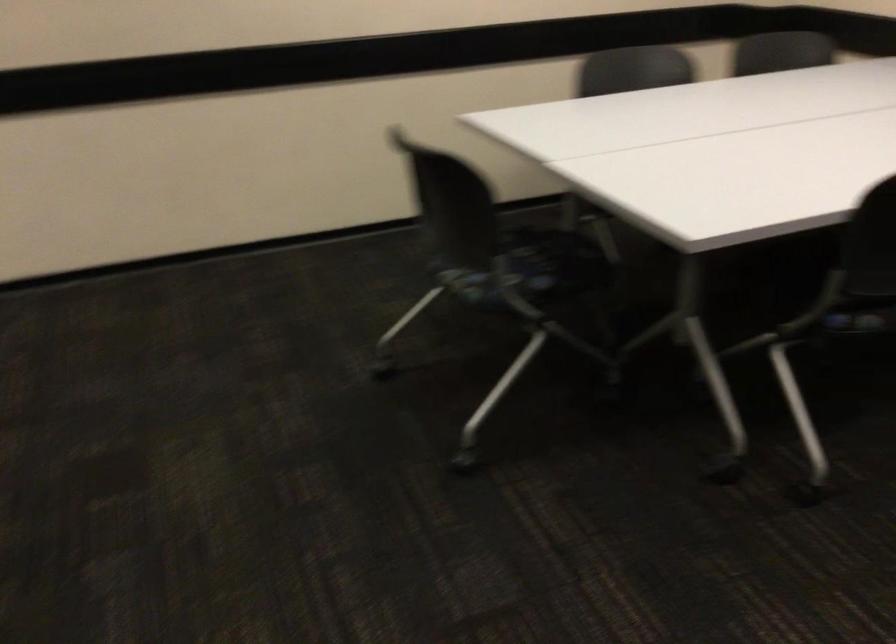
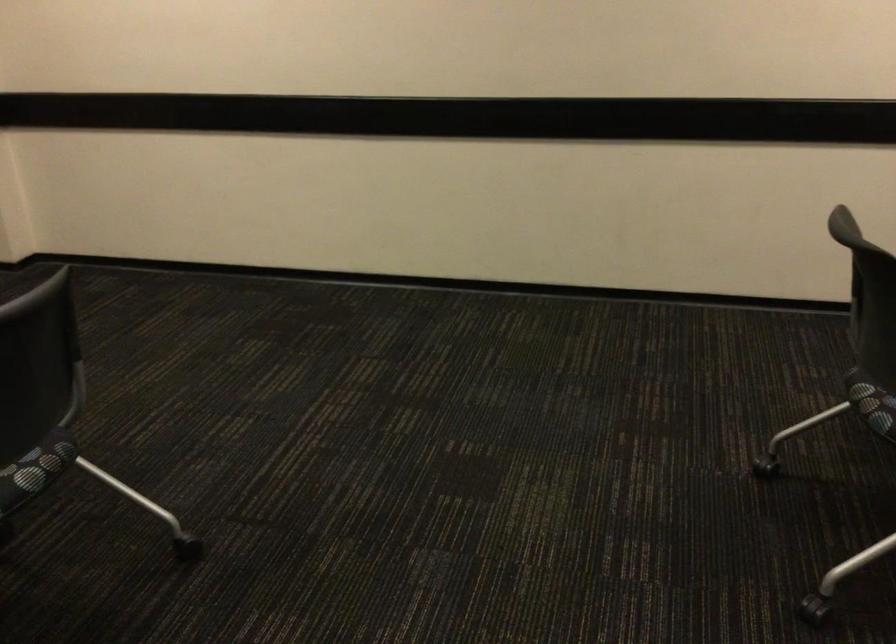
In the second image, find the point that corresponds to the point at 457,289 in the first image.

(874, 408)